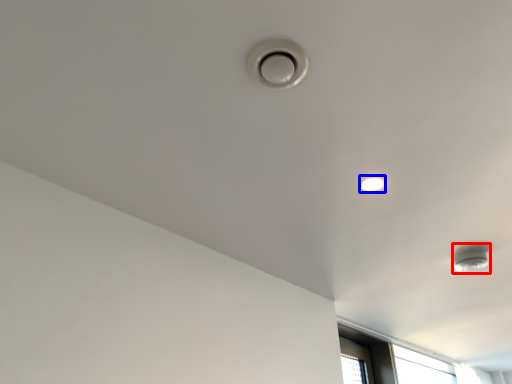
Question: Which object appears closest to the camera in this image, lamp (highlighted by a red box) or droplight (highlighted by a blue box)?

Choices:
 (A) lamp
 (B) droplight

Answer: (B)